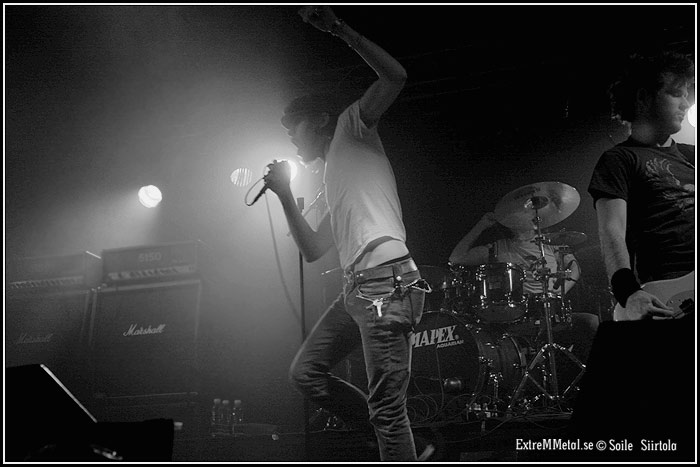
Where is `white light`? white light is located at coordinates (148, 189).